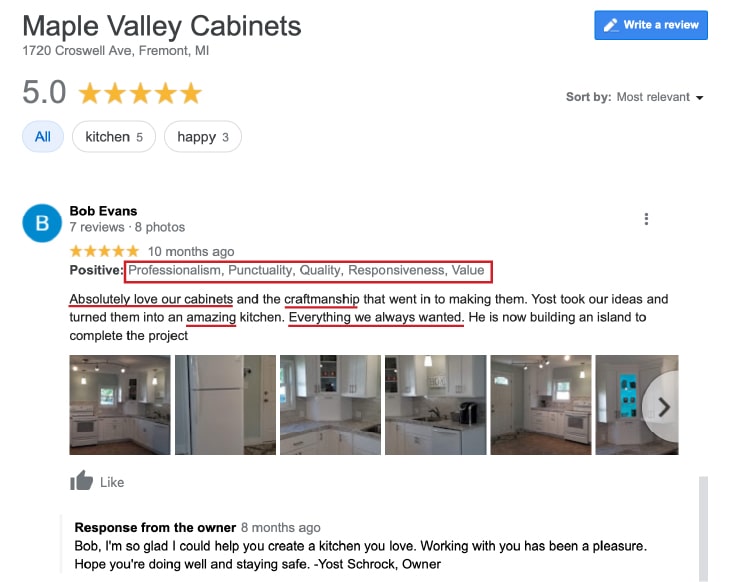
This screenshot has height=582, width=730. Find the location of `refrigerator`. refrigerator is located at coordinates (204, 411).